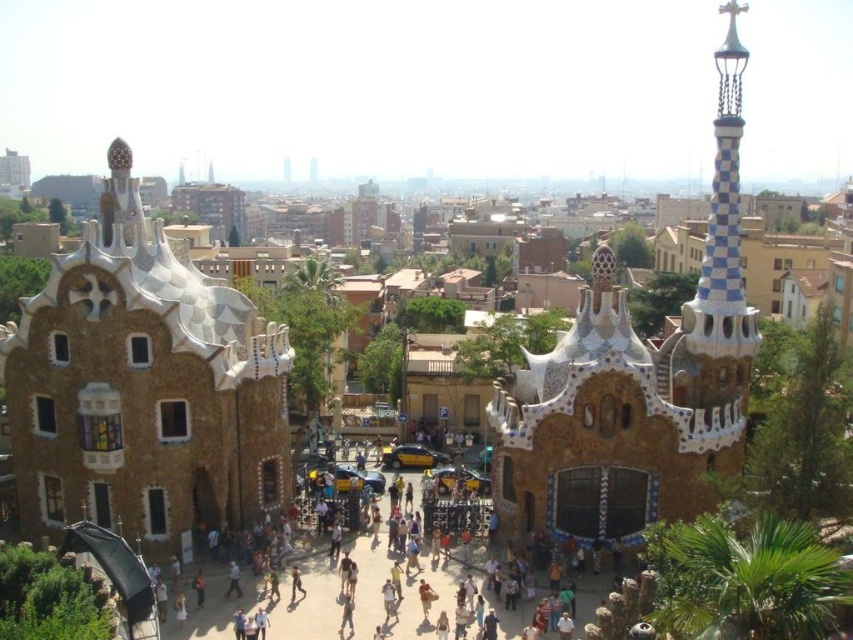
You are a tourist standing at the entrance of the plaza, and you want to take a photo that includes both the blue and white mosaic spire at upper right and the brown textured stone archway at center. Given that your camera has a maximum zoom range of 25 meters, will you be able to capture both objects in the same frame without moving closer?

The blue and white mosaic spire at upper right is 27.84 meters away from the brown textured stone archway at center. Since the distance between them exceeds the camera maximum zoom range of 25 meters, you will not be able to capture both objects in the same frame without moving closer.

You are a tourist standing in the plaza and want to take a photo that includes both the white mosaic building at left and the brown textured stone archway at center. Since you have a wide angle lens, you can capture a large area. However, you want to ensure that both objects are fully visible in the frame. Given their sizes, which object should you position closer to the center of the photo to ensure both are in the frame?

Since the white mosaic building at left is bigger than the brown textured stone archway at center, you should position the white mosaic building at left closer to the center of the photo. This way, its larger size will be accommodated within the frame while still allowing the smaller brown textured stone archway at center to be visible.

You are a tourist standing in the plaza and want to take a photo of the white mosaic building at left and the brown textured stone archway at center. If your camera can focus on objects up to 50 feet away, will both structures be in focus?

The white mosaic building at left is 51.33 feet from the brown textured stone archway at center. Since the camera can focus up to 50 feet, the white mosaic building at left is slightly out of the camera range. Therefore, it might not be in focus.